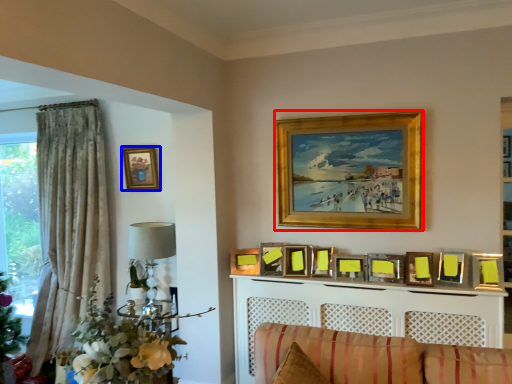
Question: Which object appears closest to the camera in this image, picture frame (highlighted by a red box) or picture frame (highlighted by a blue box)?

Choices:
 (A) picture frame
 (B) picture frame

Answer: (A)